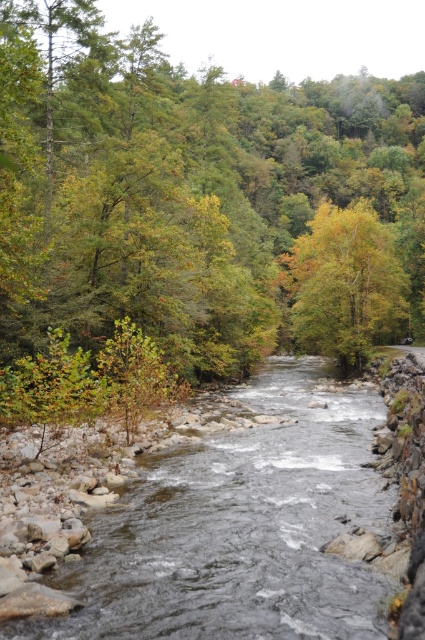
Question: Does clear water at center have a larger size compared to yellow-green leaves at center?

Choices:
 (A) no
 (B) yes

Answer: (A)

Question: Estimate the real-world distances between objects in this image. Which object is farther from the yellow-green leaves at center?

Choices:
 (A) green leafy tree at upper center
 (B) clear water at center

Answer: (A)

Question: Which of these objects is positioned farthest from the green leafy tree at upper center?

Choices:
 (A) clear water at center
 (B) yellow-green leaves at center

Answer: (A)

Question: From the image, what is the correct spatial relationship of green leafy tree at upper center in relation to yellow-green leaves at center?

Choices:
 (A) above
 (B) below

Answer: (A)

Question: Which object is the closest to the green leafy tree at upper center?

Choices:
 (A) yellow-green leaves at center
 (B) clear water at center

Answer: (A)

Question: Can you confirm if green leafy tree at upper center is bigger than clear water at center?

Choices:
 (A) yes
 (B) no

Answer: (A)